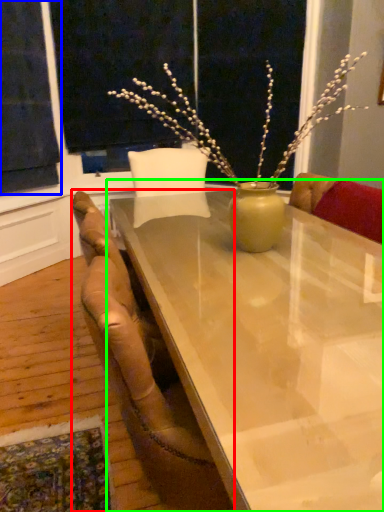
Question: Based on their relative distances, which object is nearer to chair (highlighted by a red box)? Choose from curtain (highlighted by a blue box) and table (highlighted by a green box).

Choices:
 (A) curtain
 (B) table

Answer: (B)